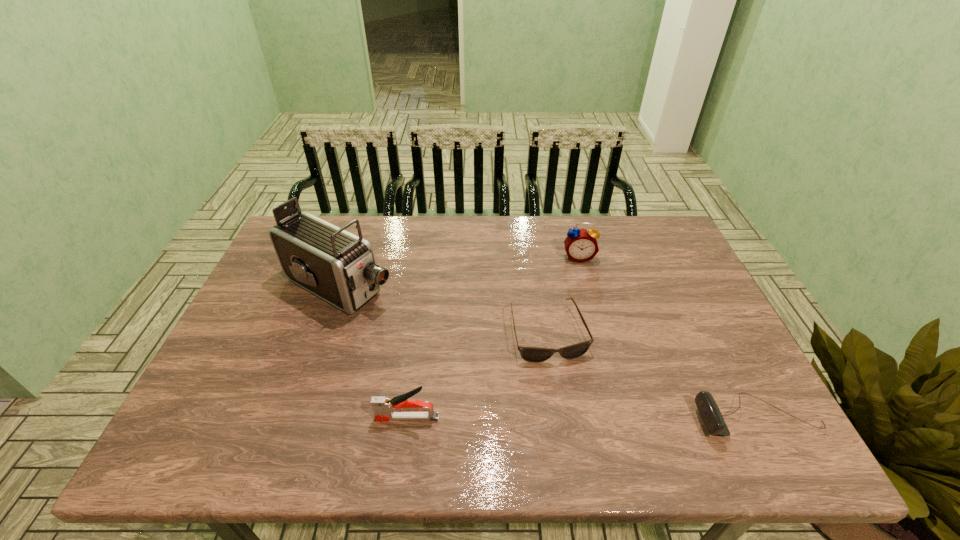
Locate an element on the screen. The height and width of the screenshot is (540, 960). vacant space located at the lens of the camcorder is located at coordinates (415, 320).

Where is `free point located 0.090m at the lens of the camcorder`? The image size is (960, 540). free point located 0.090m at the lens of the camcorder is located at coordinates (409, 316).

The image size is (960, 540). Find the location of `alarm clock that is at the far edge`. alarm clock that is at the far edge is located at coordinates (581, 245).

Find the location of `camcorder that is at the far edge`. camcorder that is at the far edge is located at coordinates (339, 267).

You are a GUI agent. You are given a task and a screenshot of the screen. Output one action in this format:
    pyautogui.click(x=<x>, y=<y>)
    Task: Click on the stapler at the near edge
    Image resolution: width=960 pixels, height=540 pixels.
    Given the screenshot: What is the action you would take?
    pyautogui.click(x=385, y=409)

You are a GUI agent. You are given a task and a screenshot of the screen. Output one action in this format:
    pyautogui.click(x=<x>, y=<y>)
    Task: Click on the webcam positioned at the near edge
    This screenshot has height=540, width=960.
    Given the screenshot: What is the action you would take?
    pyautogui.click(x=709, y=412)

In order to click on object at the left edge in this screenshot , I will do `click(339, 267)`.

Find the location of a particular element. object present at the right edge is located at coordinates (709, 412).

Locate an element on the screen. object present at the far left corner is located at coordinates (339, 267).

Where is `object at the near right corner`? The width and height of the screenshot is (960, 540). object at the near right corner is located at coordinates (709, 412).